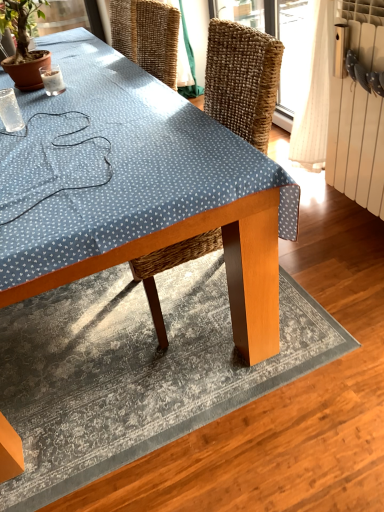
What do you see at coordinates (23, 44) in the screenshot? I see `green leafy plant at upper left` at bounding box center [23, 44].

At what (x,y) coordinates should I click in order to perform the action: click on textured gray rug at center. Please return your answer as a coordinate pair (x, y). The height and width of the screenshot is (512, 384). Looking at the image, I should click on (136, 370).

Identify the location of white radiator at right. This screenshot has width=384, height=512. (356, 143).

Locate an element on the screen. This screenshot has width=384, height=512. clear glass coffee cup at upper left, which appears as the 1th coffee cup when viewed from the top is located at coordinates (52, 80).

You are a GUI agent. You are given a task and a screenshot of the screen. Output one action in this format:
    pyautogui.click(x=<x>, y=<y>)
    Task: Click on the transparent plastic cup at upper left, the 1th coffee cup when ordered from bottom to top
    This screenshot has width=384, height=512.
    Given the screenshot: What is the action you would take?
    pyautogui.click(x=10, y=111)

From a real-world perspective, is textured gray rug at center on green leafy plant at upper left?

No, from a real-world perspective, textured gray rug at center is not above green leafy plant at upper left.

Is the surface of textured gray rug at center in direct contact with green leafy plant at upper left?

No.

Between textured gray rug at center and green leafy plant at upper left, which one appears on the left side from the viewer's perspective?

From the viewer's perspective, green leafy plant at upper left appears more on the left side.

From the image's perspective, is textured gray rug at center under green leafy plant at upper left?

Yes, from the image's perspective, textured gray rug at center is below green leafy plant at upper left.

Can you confirm if textured gray rug at center is positioned to the right of white radiator at right?

In fact, textured gray rug at center is to the left of white radiator at right.

Does point (53, 480) come farther from viewer compared to point (383, 7)?

No, it is not.

Which of these two, textured gray rug at center or white radiator at right, is smaller?

With smaller size is white radiator at right.

Is textured gray rug at center not inside white radiator at right?

Absolutely, textured gray rug at center is external to white radiator at right.

Looking at this image, relative to clear glass coffee cup at upper left, which is counted as the second coffee cup, starting from the bottom, is green leafy plant at upper left in front or behind?

Visually, green leafy plant at upper left is located in front of clear glass coffee cup at upper left, which is counted as the second coffee cup, starting from the bottom.

Can you confirm if green leafy plant at upper left is thinner than clear glass coffee cup at upper left, the first coffee cup in the back-to-front sequence?

No.

What's the angular difference between green leafy plant at upper left and clear glass coffee cup at upper left, the first coffee cup in the back-to-front sequence,'s facing directions?

green leafy plant at upper left and clear glass coffee cup at upper left, the first coffee cup in the back-to-front sequence, are facing 83.3 degrees away from each other.

Is green leafy plant at upper left far away from clear glass coffee cup at upper left, the first coffee cup in the back-to-front sequence?

They are positioned close to each other.

Locate an element on the screen. The width and height of the screenshot is (384, 512). houseplant behind the textured gray rug at center is located at coordinates (23, 44).

From a real-world perspective, is green leafy plant at upper left positioned above or below textured gray rug at center?

green leafy plant at upper left is above textured gray rug at center.

Is point (25, 49) closer or farther from the camera than point (96, 371)?

Clearly, point (25, 49) is more distant from the camera than point (96, 371).

Consider the image. Is green leafy plant at upper left at the right side of textured gray rug at center?

In fact, green leafy plant at upper left is to the left of textured gray rug at center.

Is point (181, 234) less distant than point (18, 420)?

Yes, point (181, 234) is closer to viewer.

Considering the relative positions of wooden table at center and textured gray rug at center in the image provided, is wooden table at center to the left of textured gray rug at center from the viewer's perspective?

No, wooden table at center is not to the left of textured gray rug at center.

Looking at this image, is textured gray rug at center completely or partially inside wooden table at center?

No, textured gray rug at center is not a part of wooden table at center.

Could you tell me if clear glass coffee cup at upper left, the first coffee cup in the back-to-front sequence, is turned towards green leafy plant at upper left?

Yes, clear glass coffee cup at upper left, the first coffee cup in the back-to-front sequence, is aimed at green leafy plant at upper left.

Is point (58, 66) farther from viewer compared to point (14, 56)?

Yes, it is behind point (14, 56).

Which is in front, clear glass coffee cup at upper left, which appears as the 1th coffee cup when viewed from the top, or green leafy plant at upper left?

green leafy plant at upper left is closer to the camera.

Is point (50, 88) less distant than point (332, 358)?

That is False.

Could you tell me if clear glass coffee cup at upper left, the first coffee cup in the back-to-front sequence, is turned towards textured gray rug at center?

No, clear glass coffee cup at upper left, the first coffee cup in the back-to-front sequence, is not oriented towards textured gray rug at center.

Image resolution: width=384 pixels, height=512 pixels. In order to click on mat that appears in front of the green leafy plant at upper left in this screenshot , I will do `click(136, 370)`.

The image size is (384, 512). In order to click on mat below the white radiator at right (from the image's perspective) in this screenshot , I will do `click(136, 370)`.

Consider the image. Looking at the image, which one is located closer to wooden table at center, textured gray rug at center or green leafy plant at upper left?

textured gray rug at center.

Looking at the image, which one is located further to textured gray rug at center, green leafy plant at upper left or clear glass coffee cup at upper left, which appears as the 1th coffee cup when viewed from the top?

green leafy plant at upper left.

Considering their positions, is green leafy plant at upper left positioned further to wooden table at center than textured gray rug at center?

green leafy plant at upper left is positioned further to the anchor wooden table at center.

When comparing their distances from green leafy plant at upper left, does white radiator at right or textured gray rug at center seem further?

Based on the image, white radiator at right appears to be further to green leafy plant at upper left.

Considering their positions, is white radiator at right positioned closer to transparent plastic cup at upper left, which appears as the 2th coffee cup when viewed from the back, than clear glass coffee cup at upper left, which appears as the 1th coffee cup when viewed from the top?

clear glass coffee cup at upper left, which appears as the 1th coffee cup when viewed from the top, is positioned closer to the anchor transparent plastic cup at upper left, which appears as the 2th coffee cup when viewed from the back.

Estimate the real-world distances between objects in this image. Which object is closer to clear glass coffee cup at upper left, the first coffee cup in the back-to-front sequence, transparent plastic cup at upper left, which appears as the second coffee cup when viewed from the top, or green leafy plant at upper left?

Among the two, green leafy plant at upper left is located nearer to clear glass coffee cup at upper left, the first coffee cup in the back-to-front sequence.

From the image, which object appears to be nearer to textured gray rug at center, green leafy plant at upper left or wooden table at center?

wooden table at center lies closer to textured gray rug at center than the other object.

Based on their spatial positions, is wooden table at center or transparent plastic cup at upper left, which appears as the 2th coffee cup when viewed from the back, further from clear glass coffee cup at upper left, the 2th coffee cup in the front-to-back sequence?

Among the two, wooden table at center is located further to clear glass coffee cup at upper left, the 2th coffee cup in the front-to-back sequence.

The image size is (384, 512). I want to click on mat located between transparent plastic cup at upper left, the 1th coffee cup when ordered from bottom to top, and white radiator at right in the left-right direction, so click(x=136, y=370).

The image size is (384, 512). What are the coordinates of `coffee cup between transparent plastic cup at upper left, which appears as the second coffee cup when viewed from the top, and white radiator at right` in the screenshot? It's located at (52, 80).

Image resolution: width=384 pixels, height=512 pixels. I want to click on mat between green leafy plant at upper left and white radiator at right, so click(136, 370).

Identify the location of coffee cup between green leafy plant at upper left and transparent plastic cup at upper left, which appears as the second coffee cup when viewed from the top, in the vertical direction. The width and height of the screenshot is (384, 512). [x=52, y=80].